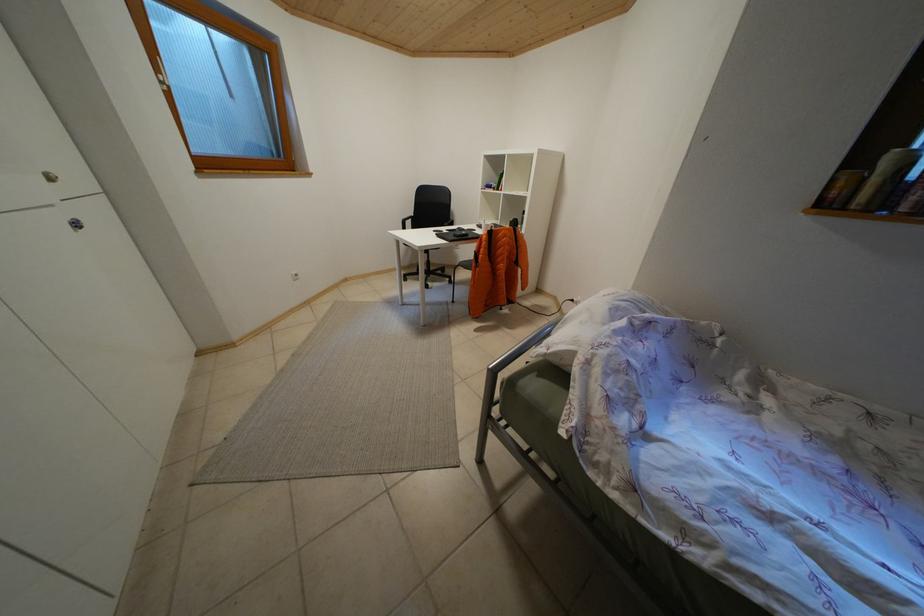
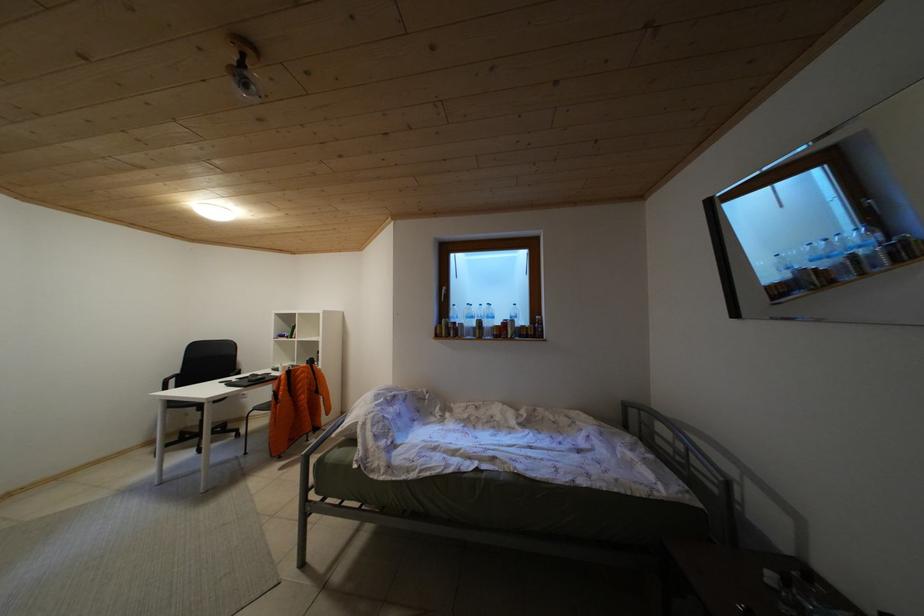
How did the camera likely rotate?

The rotation direction of the camera is right-up.